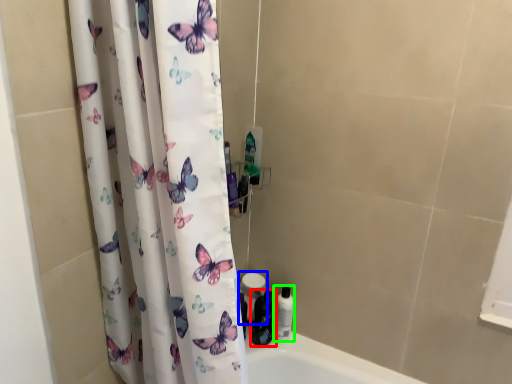
Question: Which object is the closest to the toiletry (highlighted by a red box)? Choose among these: toilet paper (highlighted by a blue box) or toiletry (highlighted by a green box).

Choices:
 (A) toilet paper
 (B) toiletry

Answer: (B)